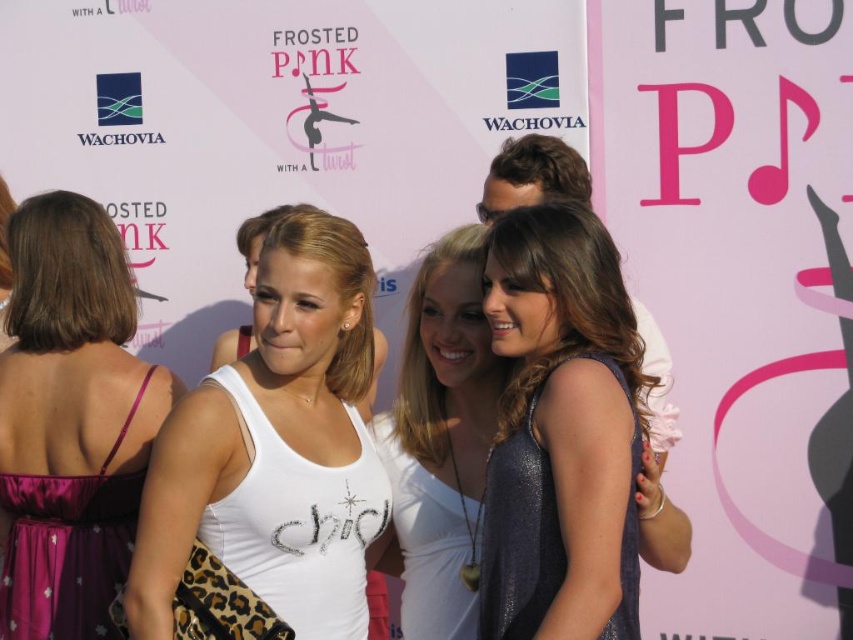
Question: Among these points, which one is nearest to the camera?

Choices:
 (A) (393, 532)
 (B) (216, 392)

Answer: (B)

Question: Which of the following is the closest to the observer?

Choices:
 (A) shiny blue dress at center
 (B) white matte tank top at center
 (C) white fabric shirt at center
 (D) purple satin dress at left

Answer: (A)

Question: Can you confirm if purple satin dress at left is positioned to the right of white fabric shirt at center?

Choices:
 (A) no
 (B) yes

Answer: (A)

Question: Is purple satin dress at left in front of white fabric shirt at center?

Choices:
 (A) no
 (B) yes

Answer: (A)

Question: Considering the relative positions of shiny blue dress at center and purple satin dress at left in the image provided, where is shiny blue dress at center located with respect to purple satin dress at left?

Choices:
 (A) right
 (B) left

Answer: (A)

Question: Which object is the farthest from the white fabric shirt at center?

Choices:
 (A) white matte tank top at center
 (B) purple satin dress at left
 (C) shiny blue dress at center

Answer: (B)